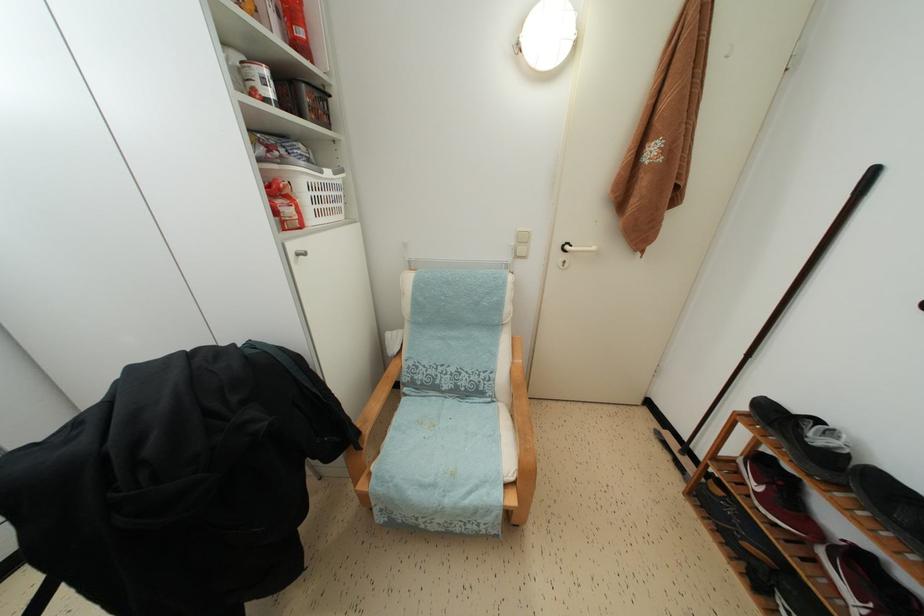
Where is `chair sitting surface`? Image resolution: width=924 pixels, height=616 pixels. chair sitting surface is located at coordinates (441, 459).